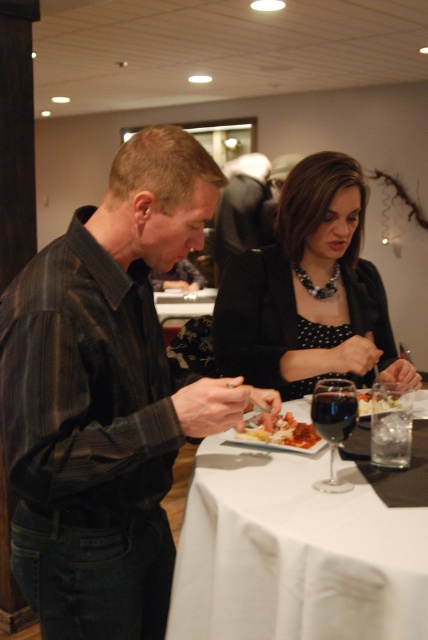
Is black dotted dress at center positioned in front of transparent glass at table center?

No, it is behind transparent glass at table center.

Identify the location of black dotted dress at center. (309, 291).

Who is higher up, clear glass wine glass at table center or smooth creamy pasta at center?

smooth creamy pasta at center

Does point (406, 426) lie in front of point (380, 396)?

Yes, it is in front of point (380, 396).

The width and height of the screenshot is (428, 640). What do you see at coordinates (391, 424) in the screenshot? I see `clear glass wine glass at table center` at bounding box center [391, 424].

Identify the location of clear glass wine glass at table center. The height and width of the screenshot is (640, 428). pos(391,424).

Who is positioned more to the left, black striped shirt at center or transparent glass at table center?

Positioned to the left is black striped shirt at center.

Describe the element at coordinates (107, 397) in the screenshot. I see `black striped shirt at center` at that location.

This screenshot has height=640, width=428. Identify the location of black striped shirt at center. (107, 397).